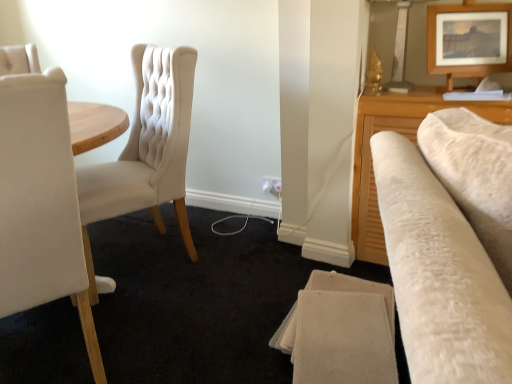
Question: Is white plastic electric outlet at lower center further to the viewer compared to wooden picture frame at upper right?

Choices:
 (A) no
 (B) yes

Answer: (B)

Question: Would you say wooden picture frame at upper right is part of white plastic electric outlet at lower center's contents?

Choices:
 (A) no
 (B) yes

Answer: (A)

Question: Considering the relative sizes of white plastic electric outlet at lower center and wooden picture frame at upper right in the image provided, is white plastic electric outlet at lower center thinner than wooden picture frame at upper right?

Choices:
 (A) no
 (B) yes

Answer: (B)

Question: Does white plastic electric outlet at lower center have a greater width compared to wooden picture frame at upper right?

Choices:
 (A) no
 (B) yes

Answer: (A)

Question: From the image's perspective, is white plastic electric outlet at lower center below wooden picture frame at upper right?

Choices:
 (A) yes
 (B) no

Answer: (A)

Question: Considering the positions of matte cream fabric chair at left, the 2th chair when ordered from front to back, and white plastic electric outlet at lower center in the image, is matte cream fabric chair at left, the 2th chair when ordered from front to back, bigger or smaller than white plastic electric outlet at lower center?

Choices:
 (A) big
 (B) small

Answer: (A)

Question: Is point (177, 54) positioned closer to the camera than point (270, 180)?

Choices:
 (A) closer
 (B) farther

Answer: (A)

Question: From a real-world perspective, is matte cream fabric chair at left, the 1th chair from the back, positioned above or below white plastic electric outlet at lower center?

Choices:
 (A) below
 (B) above

Answer: (B)

Question: Would you say matte cream fabric chair at left, the 1th chair from the back, is inside or outside white plastic electric outlet at lower center?

Choices:
 (A) inside
 (B) outside

Answer: (B)

Question: Based on their sizes in the image, would you say matte cream fabric chair at left, the 2th chair when ordered from front to back, is bigger or smaller than white leather chair at left, placed as the first chair when sorted from front to back?

Choices:
 (A) small
 (B) big

Answer: (B)

Question: From the image's perspective, is matte cream fabric chair at left, the 2th chair when ordered from front to back, positioned above or below white leather chair at left, placed as the first chair when sorted from front to back?

Choices:
 (A) below
 (B) above

Answer: (B)

Question: In terms of width, does matte cream fabric chair at left, the 1th chair from the back, look wider or thinner when compared to white leather chair at left, the 2th chair when ordered from back to front?

Choices:
 (A) thin
 (B) wide

Answer: (A)

Question: In terms of height, does matte cream fabric chair at left, the 2th chair when ordered from front to back, look taller or shorter compared to white leather chair at left, the 2th chair when ordered from back to front?

Choices:
 (A) tall
 (B) short

Answer: (B)

Question: Is white leather chair at left, placed as the first chair when sorted from front to back, situated inside matte cream fabric chair at left, the 2th chair when ordered from front to back, or outside?

Choices:
 (A) inside
 (B) outside

Answer: (B)

Question: From a real-world perspective, relative to matte cream fabric chair at left, the 2th chair when ordered from front to back, is white leather chair at left, placed as the first chair when sorted from front to back, vertically above or below?

Choices:
 (A) above
 (B) below

Answer: (A)